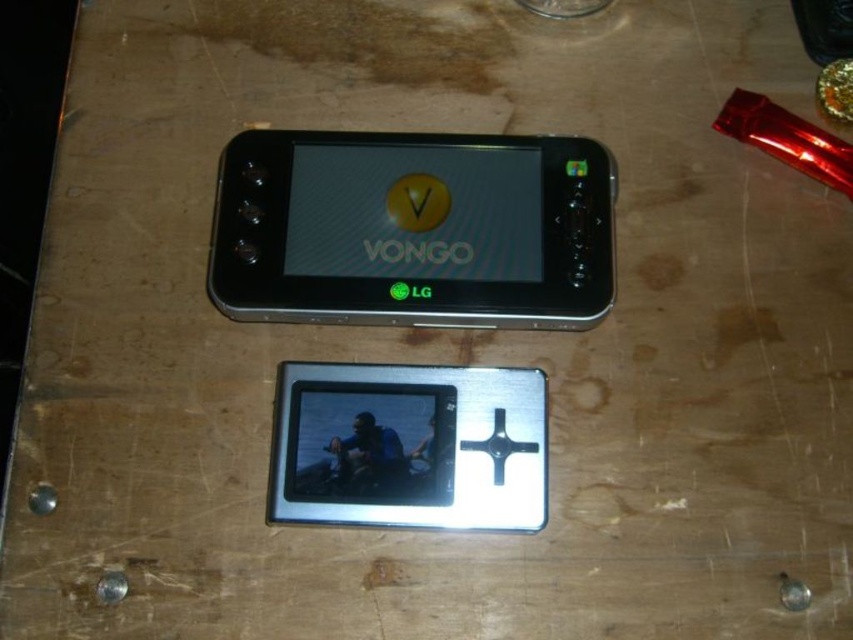
Consider the image. Is matte black phone at center thinner than silver metallic media player at center?

In fact, matte black phone at center might be wider than silver metallic media player at center.

Between matte black phone at center and silver metallic media player at center, which one has less height?

silver metallic media player at center is shorter.

Does point (260, 214) come behind point (485, 525)?

Yes, it is.

Locate an element on the screen. This screenshot has width=853, height=640. matte black phone at center is located at coordinates (413, 228).